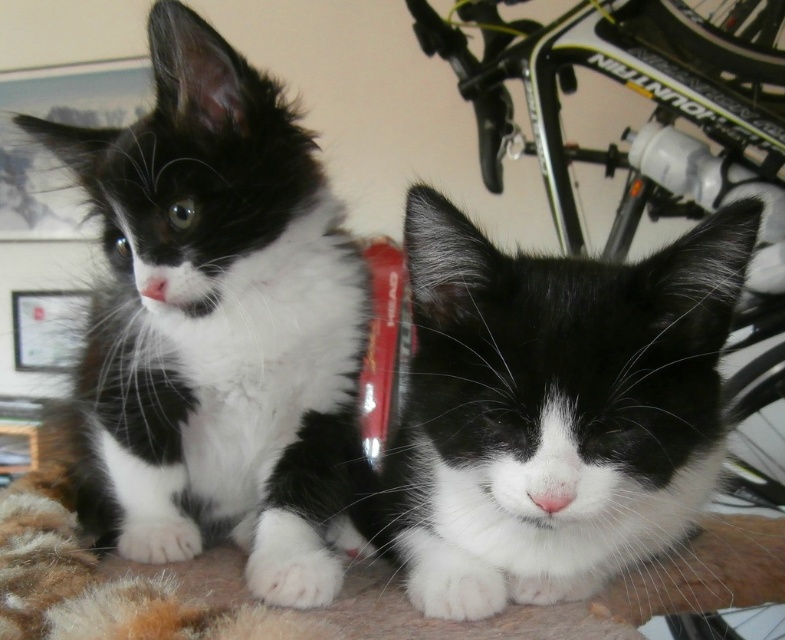
From the picture: You are a photographer trying to capture a photo of both the black and white fur cat at left and the black soft fur cat at center. Since you want both cats to be in focus, you need to know which cat is taller. Can you tell me which one is taller?

The black and white fur cat at left is taller than the black soft fur cat at center, so you should adjust your camera settings to accommodate the height difference to ensure both are in focus.

You are a photographer trying to capture a photo of the black and white fur cat at left and the black soft fur cat at center. From your current position, which cat appears higher in the frame?

The black and white fur cat at left appears higher in the frame because it is positioned above the black soft fur cat at center according to the description.

You are a photographer trying to capture both the black and white fur cat at left and the black soft fur cat at center in a single shot. Based on their positions, which cat should you focus on first to ensure both are in frame?

The black and white fur cat at left is to the left of the black soft fur cat at center, so you should focus on the black and white fur cat at left first to ensure both are in frame.